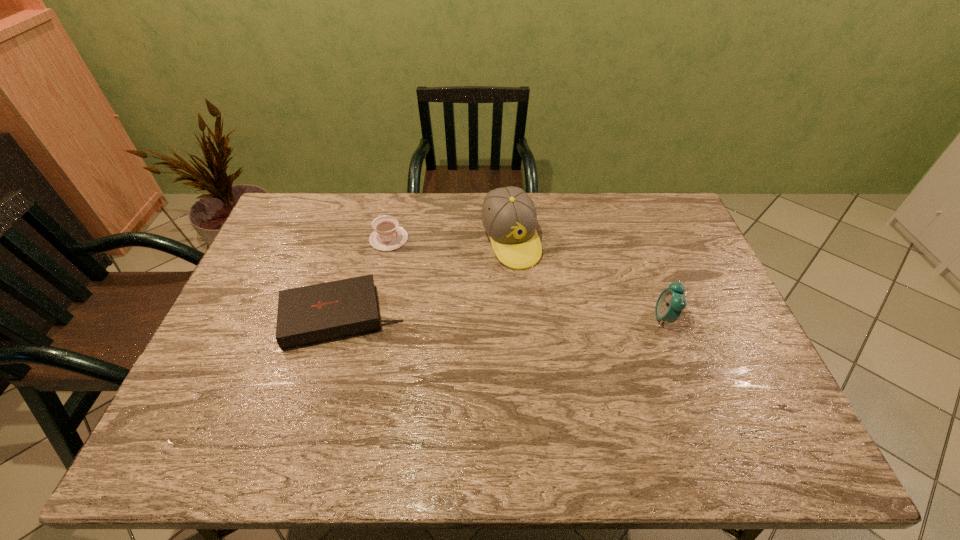
Find the location of a particular element. This screenshot has width=960, height=540. free space on the desktop that is between the shortest object and the second tallest object and is positioned on the handle side of the third tallest object is located at coordinates (518, 318).

The height and width of the screenshot is (540, 960). I want to click on vacant space on the desktop that is between the shortest object and the second tallest object and is positioned on the front-facing side of the third object from left to right, so click(x=546, y=318).